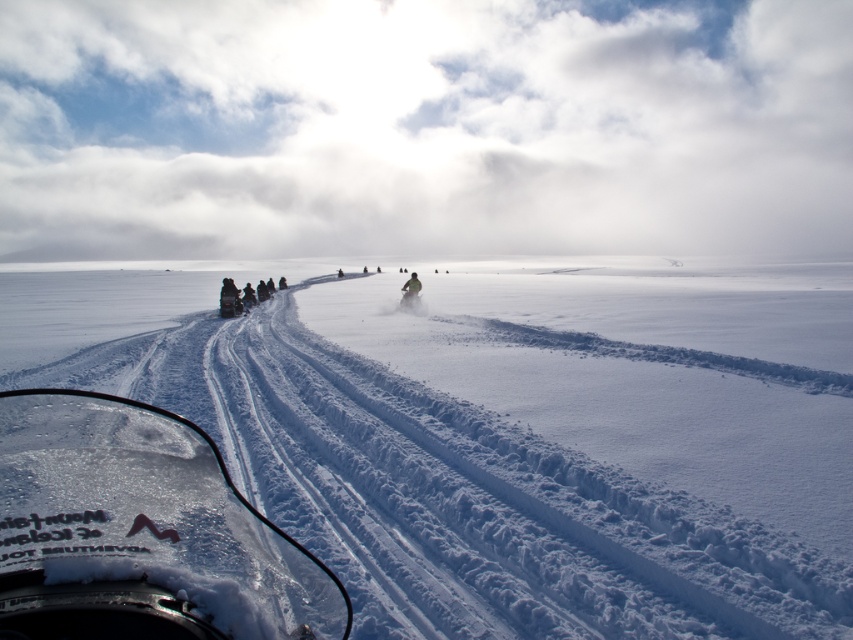
You are a passenger on a snowmobile and want to check if your jacket is properly secured. Based on the scene, is the green fabric jacket at center above or below the green matte snowmobile at center?

The green fabric jacket at center is above the green matte snowmobile at center because the snowmobile is positioned under the jacket.

You are a snowmobile rider looking through the clear plastic windshield at lower left to navigate the path ahead. Based on the windshield position at point coordinates, can you estimate how far the windshield is from the edge of the snowmobile? Please provide your answer in meters, assuming the coordinate system has a scale of 1 unit equals 10 meters.

The clear plastic windshield at lower left is positioned at coordinates point (149, 515). To determine the distance from the edge, we calculate the Euclidean distance from the windshield position to the nearest edge of the snowmobile. Assuming the snowmobile occupies a rectangular area from coordinates 0 to 1 in both x and y axes, the nearest edge would be the left edge at x coordinate 0. The distance from x coordinate 0.805 to 0 is 0.805 units, which converts to 8.05 meters. Therefore, the windshield is

You are a snowmobile rider planning to take a shortcut through the white powdery snow at center and the green matte snowmobile at center. Which object should you avoid to stay on the path?

You should avoid the white powdery snow at center because it is positioned on the left side of the green matte snowmobile at center, so staying on the path would require navigating around the snow to the right of the snowmobile.